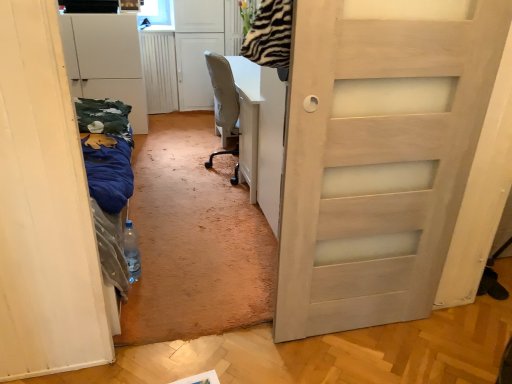
The image size is (512, 384). I want to click on vacant area that lies to the right of white matte door at left, so click(x=197, y=231).